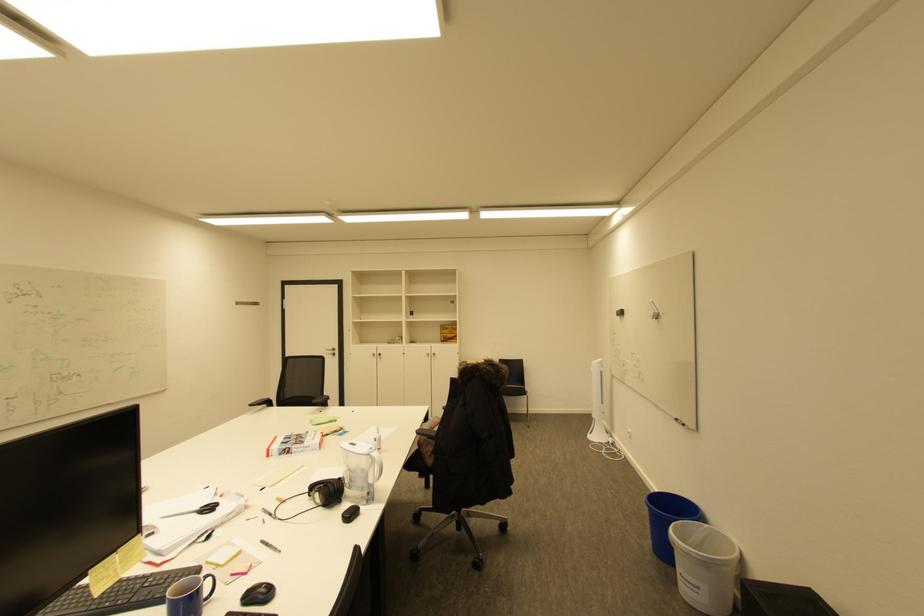
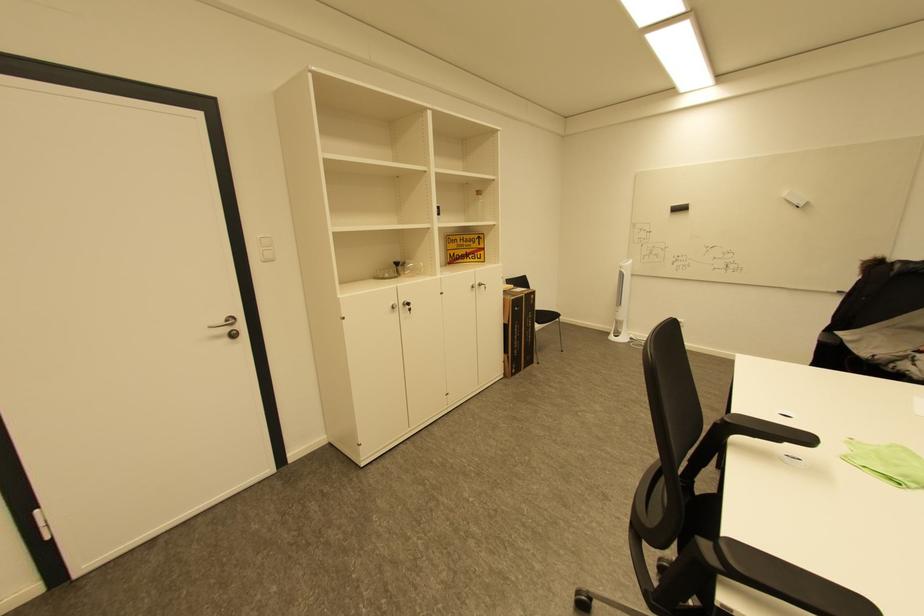
Where in the second image is the point corresponding to [338,352] from the first image?

(233, 330)